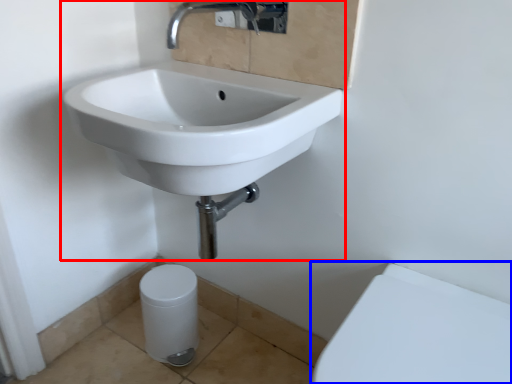
Question: Which of the following is the closest to the observer, sink (highlighted by a red box) or porcelain (highlighted by a blue box)?

Choices:
 (A) sink
 (B) porcelain

Answer: (B)